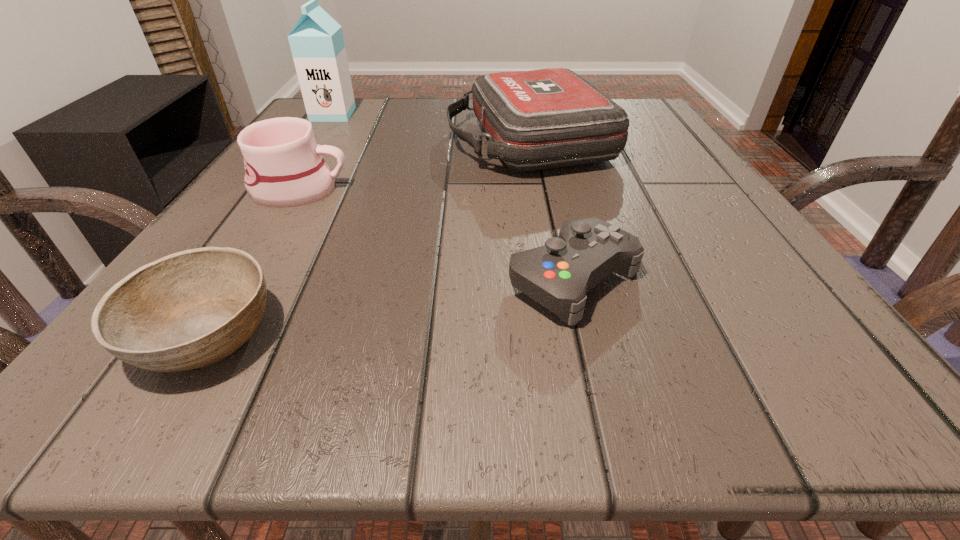
You are a GUI agent. You are given a task and a screenshot of the screen. Output one action in this format:
    pyautogui.click(x=<x>, y=<y>)
    Task: Click on the vacant space at the far edge
    This screenshot has width=960, height=540.
    Given the screenshot: What is the action you would take?
    pyautogui.click(x=411, y=115)

Where is `vacant area at the left edge of the desktop`? The height and width of the screenshot is (540, 960). vacant area at the left edge of the desktop is located at coordinates (318, 219).

Locate an element on the screen. free spot at the right edge of the desktop is located at coordinates (665, 224).

Image resolution: width=960 pixels, height=540 pixels. What are the coordinates of `blank space at the far left corner of the desktop` in the screenshot? It's located at (315, 130).

Where is `vacant space at the far right corner of the desktop`? This screenshot has height=540, width=960. vacant space at the far right corner of the desktop is located at coordinates (667, 135).

This screenshot has height=540, width=960. What are the coordinates of `unoccupied area between the milk carton and the bowl` in the screenshot? It's located at (269, 224).

You are a GUI agent. You are given a task and a screenshot of the screen. Output one action in this format:
    pyautogui.click(x=<x>, y=<y>)
    Task: Click on the vacant space that's between the bowl and the milk carton
    The width and height of the screenshot is (960, 540).
    Given the screenshot: What is the action you would take?
    pyautogui.click(x=269, y=224)

Locate an element on the screen. The height and width of the screenshot is (540, 960). empty space that is in between the first-aid kit and the mug is located at coordinates (414, 165).

I want to click on free space that is in between the first-aid kit and the mug, so click(414, 165).

In order to click on unoccupied position between the control and the mug in this screenshot , I will do `click(437, 234)`.